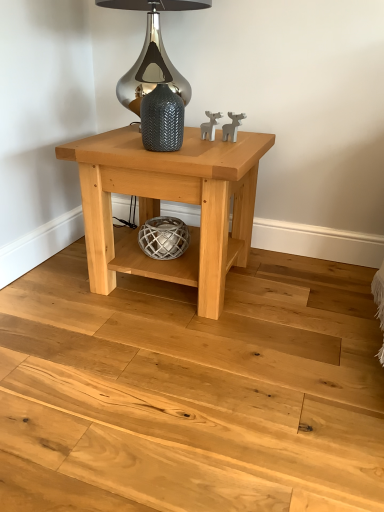
In order to click on vacant point above natural wood floor at center (from a real-world perspective) in this screenshot , I will do `click(157, 349)`.